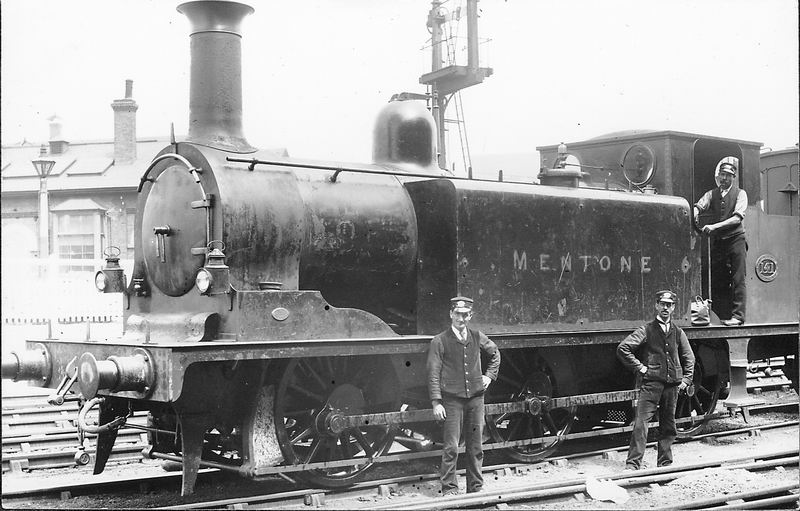
Find the location of a particular element. window is located at coordinates (80, 238).